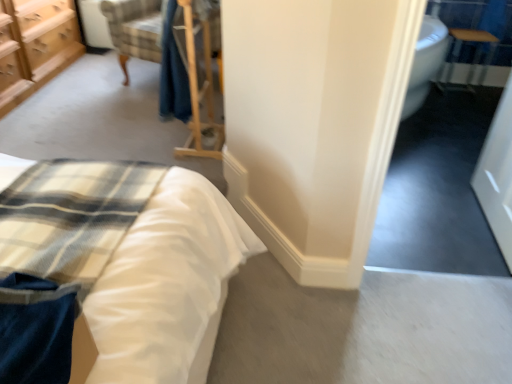
You are a GUI agent. You are given a task and a screenshot of the screen. Output one action in this format:
    pyautogui.click(x=<x>, y=<y>)
    Task: Click on the free region on the left part of white glossy door at right
    This screenshot has width=512, height=384.
    Given the screenshot: What is the action you would take?
    pyautogui.click(x=433, y=217)